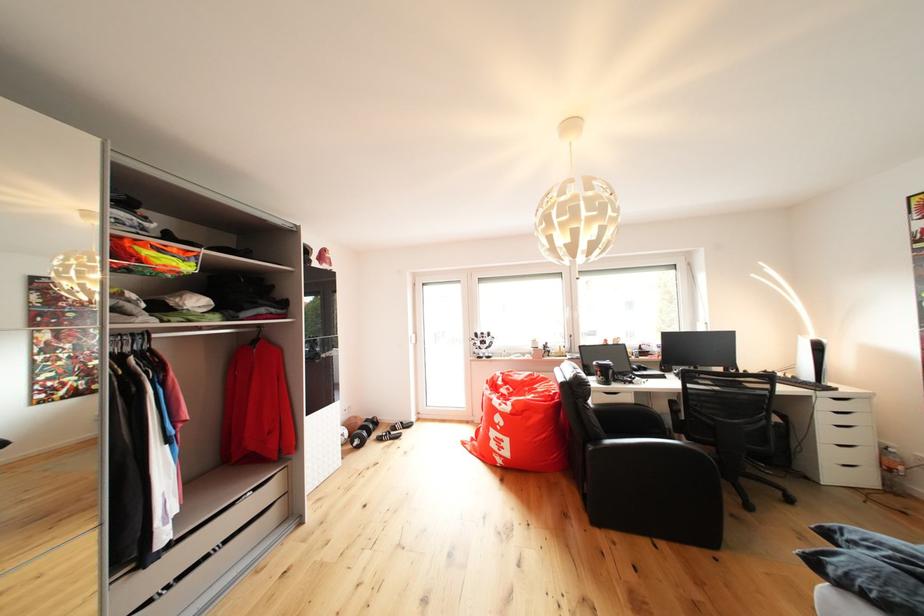
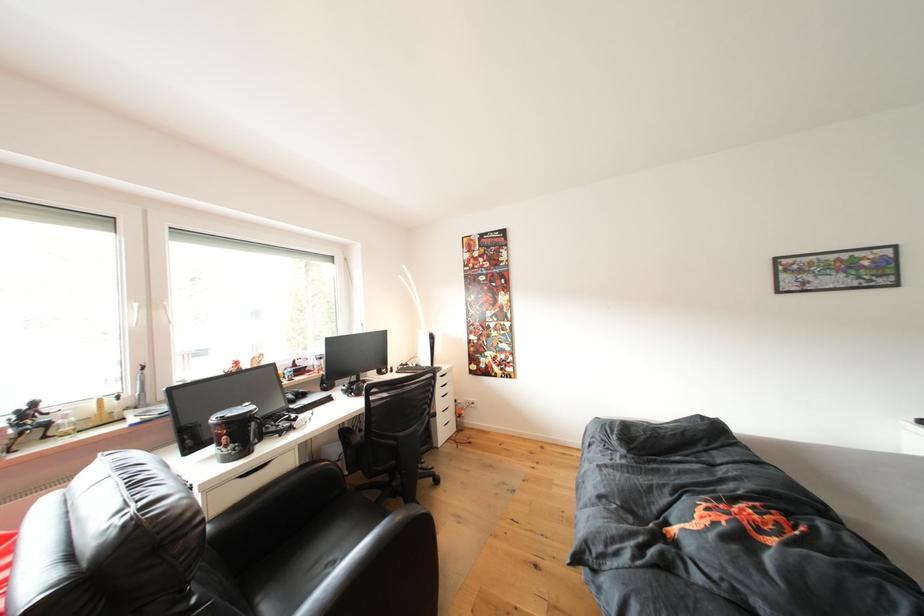
Where in the second image is the point corresponding to (839,389) from the first image?

(444, 370)